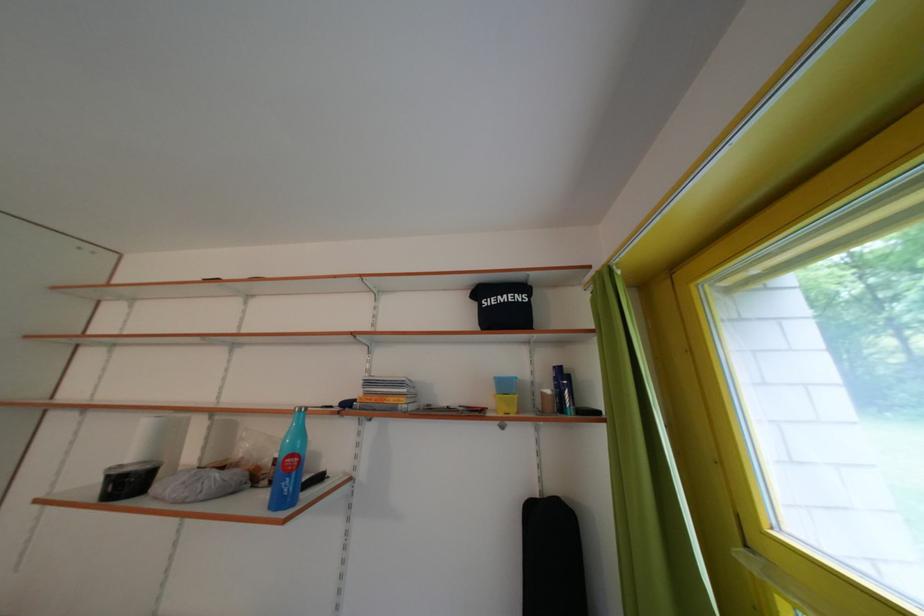
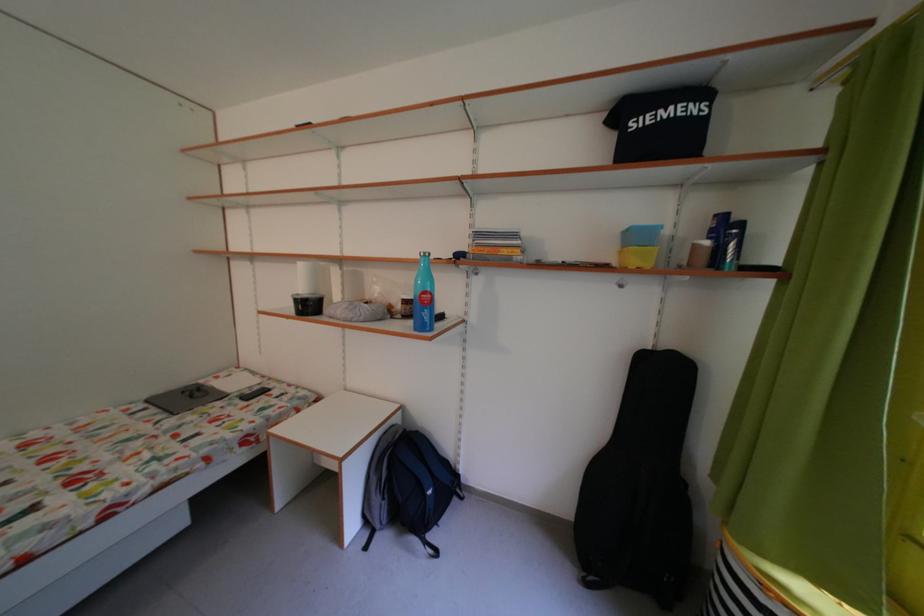
Where in the second image is the point corresponding to pixel 282 488 from the first image?

(416, 322)